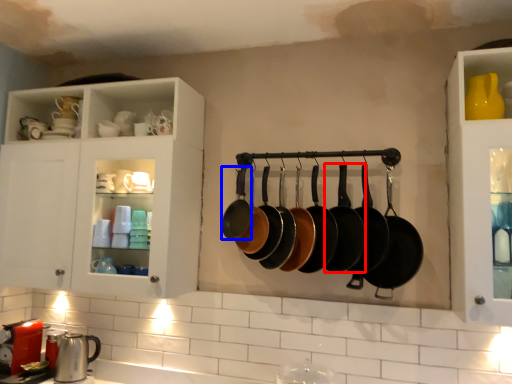
Question: Which object appears farthest to the camera in this image, frying pan (highlighted by a red box) or frying pan (highlighted by a blue box)?

Choices:
 (A) frying pan
 (B) frying pan

Answer: (B)